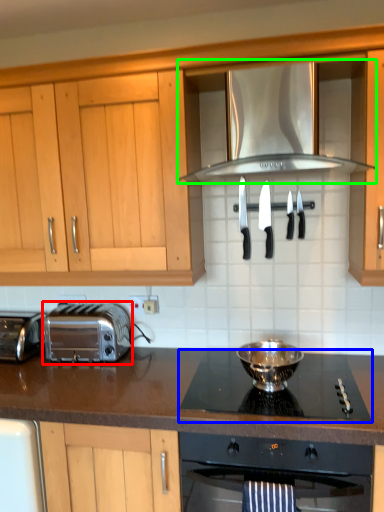
Question: Considering the real-world distances, which object is closest to toaster (highlighted by a red box)? gas stove (highlighted by a blue box) or exhaust hood (highlighted by a green box).

Choices:
 (A) gas stove
 (B) exhaust hood

Answer: (A)